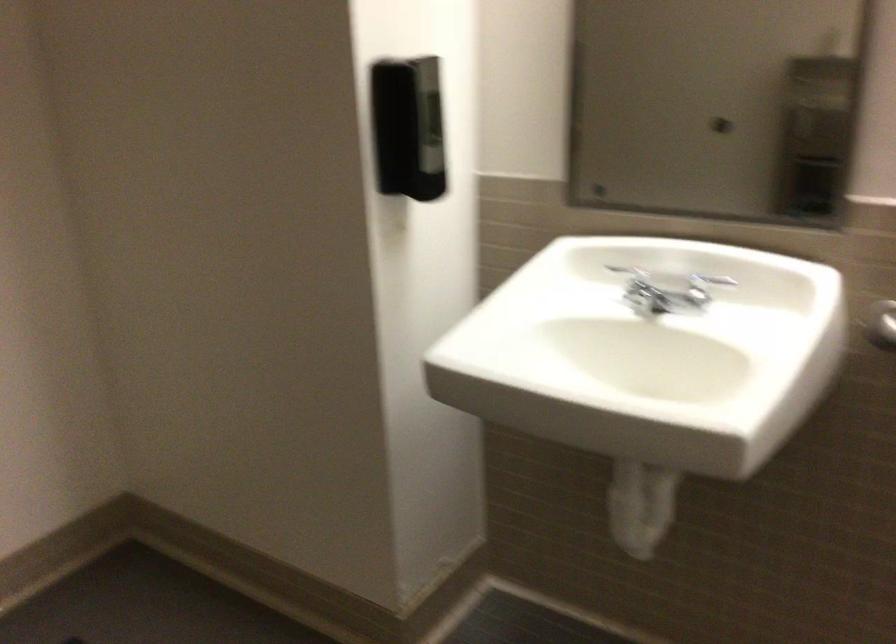
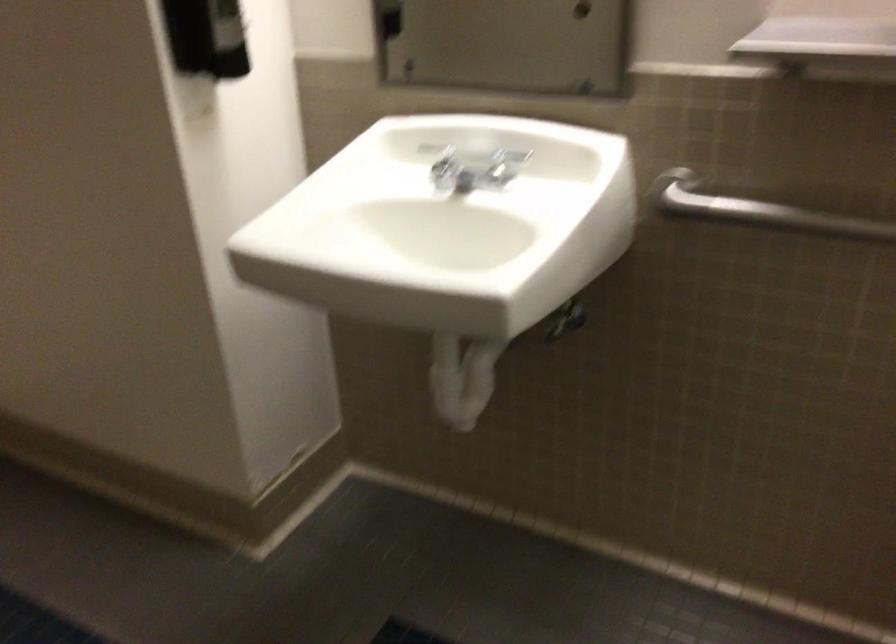
Question: The first image is from the beginning of the video and the second image is from the end. How did the camera likely rotate when shooting the video?

Choices:
 (A) Left
 (B) Right
 (C) Up
 (D) Down

Answer: (D)